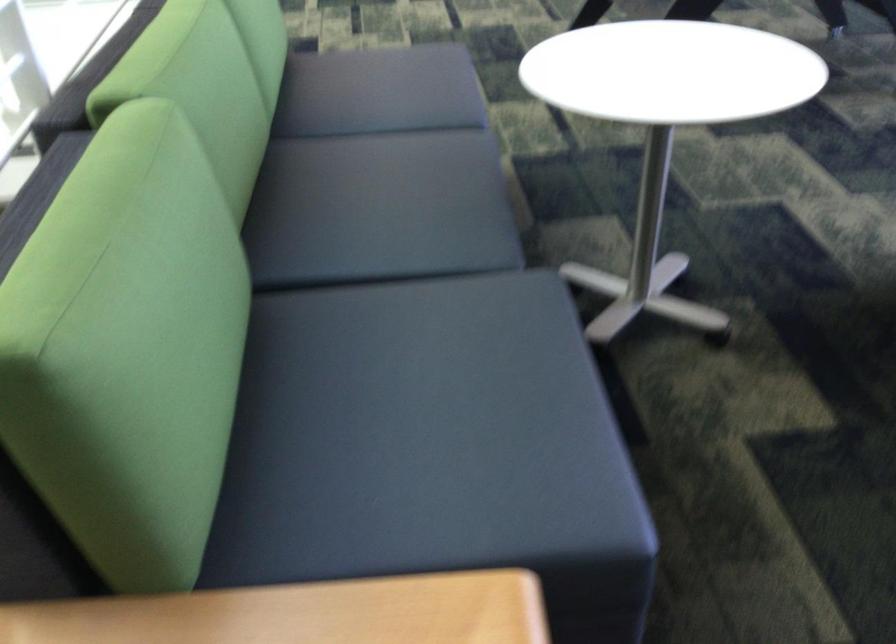
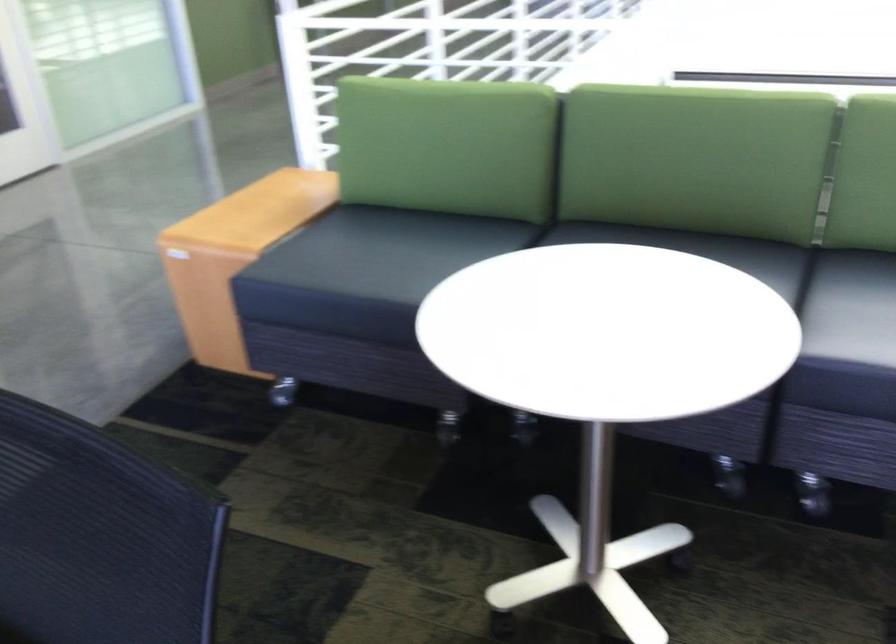
Locate, in the second image, the point that corresponds to pixel 323 175 in the first image.

(702, 250)